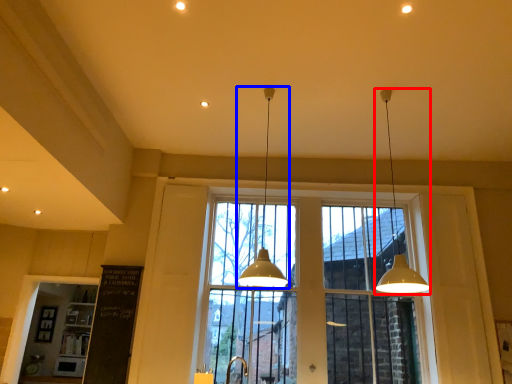
Question: Which object appears closest to the camera in this image, lamp (highlighted by a red box) or lamp (highlighted by a blue box)?

Choices:
 (A) lamp
 (B) lamp

Answer: (A)